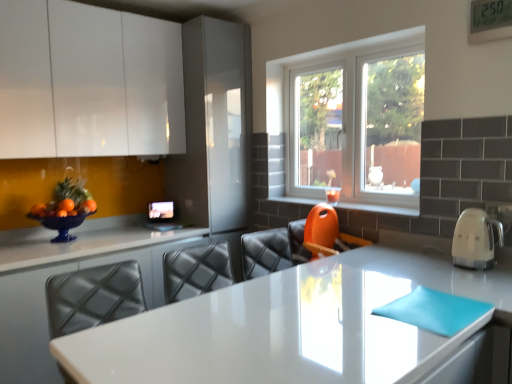
Question: Is white glossy countertop at center, the 2th countertop positioned from the right, positioned with its back to white glossy countertop at center, which is the 2th countertop in left-to-right order?

Choices:
 (A) no
 (B) yes

Answer: (A)

Question: Could you tell me if white glossy countertop at center, the 2th countertop positioned from the right, is facing white glossy countertop at center, which is the 2th countertop in left-to-right order?

Choices:
 (A) no
 (B) yes

Answer: (B)

Question: Is white glossy countertop at center, the second countertop when ordered from front to back, at the left side of white glossy countertop at center, the second countertop when ordered from back to front?

Choices:
 (A) yes
 (B) no

Answer: (A)

Question: Is white glossy countertop at center, which ranks as the first countertop in left-to-right order, located outside white glossy countertop at center, which ranks as the first countertop in front-to-back order?

Choices:
 (A) yes
 (B) no

Answer: (A)

Question: Considering the relative sizes of white glossy countertop at center, the second countertop when ordered from front to back, and white glossy countertop at center, which is the 2th countertop in left-to-right order, in the image provided, is white glossy countertop at center, the second countertop when ordered from front to back, bigger than white glossy countertop at center, which is the 2th countertop in left-to-right order,?

Choices:
 (A) yes
 (B) no

Answer: (B)

Question: Would you say white glossy countertop at center, the second countertop when ordered from back to front, is to the left or to the right of clear glass window at center in the picture?

Choices:
 (A) left
 (B) right

Answer: (A)

Question: Is white glossy countertop at center, which ranks as the first countertop in front-to-back order, bigger or smaller than clear glass window at center?

Choices:
 (A) big
 (B) small

Answer: (A)

Question: Considering the positions of white glossy countertop at center, which ranks as the first countertop in front-to-back order, and clear glass window at center in the image, is white glossy countertop at center, which ranks as the first countertop in front-to-back order, taller or shorter than clear glass window at center?

Choices:
 (A) tall
 (B) short

Answer: (B)

Question: From a real-world perspective, is white glossy countertop at center, which ranks as the first countertop in front-to-back order, positioned above or below clear glass window at center?

Choices:
 (A) above
 (B) below

Answer: (B)

Question: Considering their positions, is white glossy cabinet at upper left located in front of or behind white glossy countertop at center, which ranks as the first countertop in front-to-back order?

Choices:
 (A) front
 (B) behind

Answer: (B)

Question: Considering the positions of white glossy cabinet at upper left and white glossy countertop at center, the second countertop when ordered from back to front, in the image, is white glossy cabinet at upper left wider or thinner than white glossy countertop at center, the second countertop when ordered from back to front,?

Choices:
 (A) wide
 (B) thin

Answer: (B)

Question: Considering the positions of white glossy cabinet at upper left and white glossy countertop at center, the second countertop when ordered from back to front, in the image, is white glossy cabinet at upper left taller or shorter than white glossy countertop at center, the second countertop when ordered from back to front,?

Choices:
 (A) tall
 (B) short

Answer: (A)

Question: Choose the correct answer: Is white glossy cabinet at upper left inside white glossy countertop at center, acting as the 1th countertop starting from the right, or outside it?

Choices:
 (A) outside
 (B) inside

Answer: (A)

Question: Considering the positions of white glossy kettle at right and clear glass window at center in the image, is white glossy kettle at right wider or thinner than clear glass window at center?

Choices:
 (A) wide
 (B) thin

Answer: (A)

Question: From the image's perspective, relative to clear glass window at center, is white glossy kettle at right above or below?

Choices:
 (A) below
 (B) above

Answer: (A)